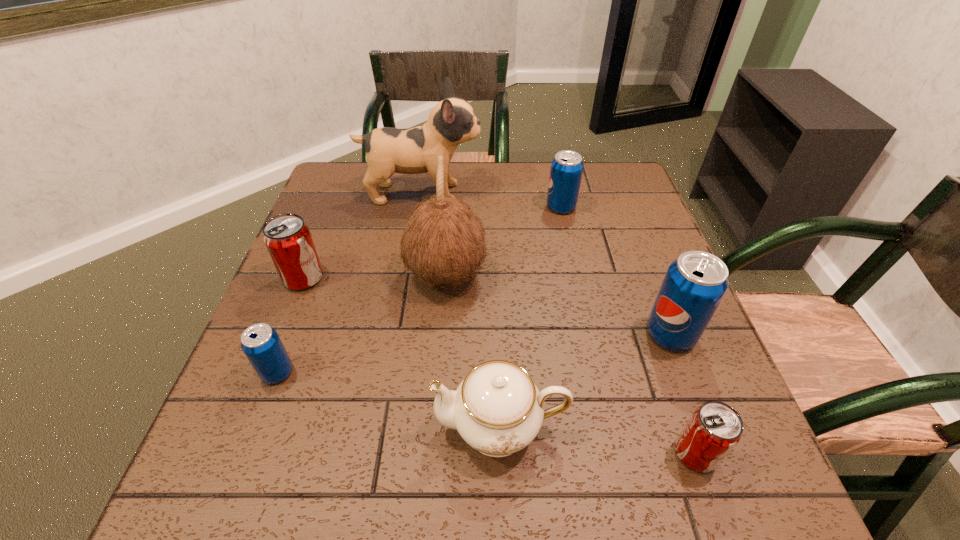
Locate an element on the screen. Image resolution: width=960 pixels, height=540 pixels. free space between the biggest blue pop soda and the sixth object from left to right is located at coordinates (615, 271).

The height and width of the screenshot is (540, 960). What are the coordinates of `free point between the chinaware and the coconut` in the screenshot? It's located at (473, 350).

This screenshot has height=540, width=960. I want to click on free space between the fourth nearest pop soda and the biggest blue pop soda, so click(x=487, y=306).

The image size is (960, 540). Find the location of `vacant area that lies between the second biggest blue pop soda and the puppy`. vacant area that lies between the second biggest blue pop soda and the puppy is located at coordinates (492, 200).

The image size is (960, 540). Identify the location of free spot between the puppy and the smaller red pop soda. (559, 323).

Identify which object is located as the seventh nearest to the coconut. Please provide its 2D coordinates. Your answer should be formatted as a tuple, i.e. [(x, y)], where the tuple contains the x and y coordinates of a point satisfying the conditions above.

[(715, 428)]

Locate an element on the screen. The image size is (960, 540). the third closest object to the farthest blue pop soda is located at coordinates [694, 285].

Choose which pop soda is the third nearest neighbor to the coconut. Please provide its 2D coordinates. Your answer should be formatted as a tuple, i.e. [(x, y)], where the tuple contains the x and y coordinates of a point satisfying the conditions above.

[(261, 344)]

Where is `the fourth closest pop soda to the puppy`? the fourth closest pop soda to the puppy is located at coordinates (694, 285).

Locate which blue pop soda ranks second in proximity to the leftmost blue pop soda. Please provide its 2D coordinates. Your answer should be formatted as a tuple, i.e. [(x, y)], where the tuple contains the x and y coordinates of a point satisfying the conditions above.

[(566, 170)]